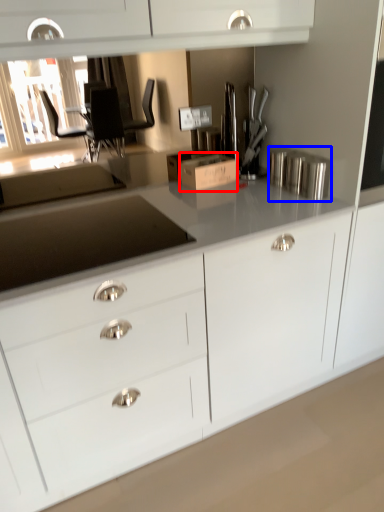
Question: Which object appears farthest to the camera in this image, cardboard box (highlighted by a red box) or appliance (highlighted by a blue box)?

Choices:
 (A) cardboard box
 (B) appliance

Answer: (A)